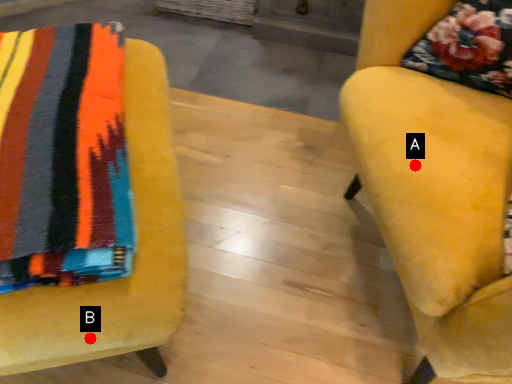
Question: Two points are circled on the image, labeled by A and B beside each circle. Which of the following is the closest to the observer?

Choices:
 (A) A is closer
 (B) B is closer

Answer: (B)